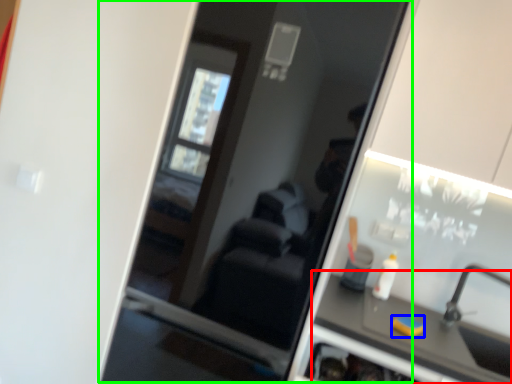
Question: Considering the real-world distances, which object is farthest from counter top (highlighted by a red box)? soap (highlighted by a blue box) or screen door (highlighted by a green box)?

Choices:
 (A) soap
 (B) screen door

Answer: (B)